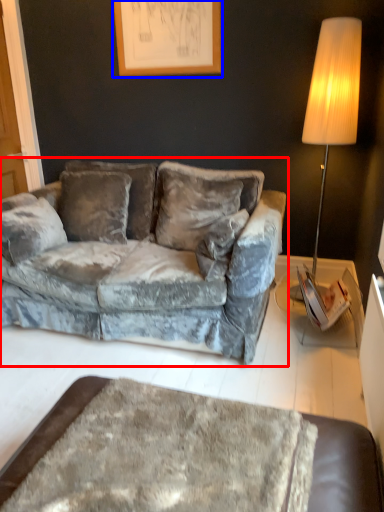
Question: Which object is closer to the camera taking this photo, studio couch (highlighted by a red box) or picture frame (highlighted by a blue box)?

Choices:
 (A) studio couch
 (B) picture frame

Answer: (A)